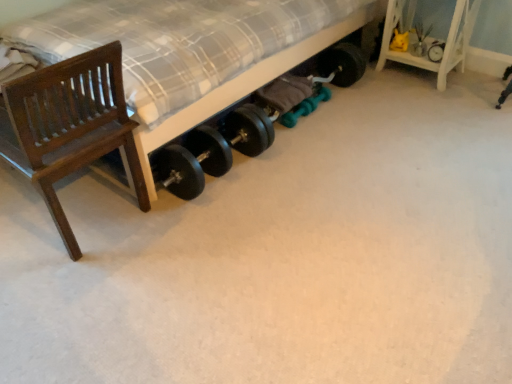
Question: Is there a large distance between black rubber tire at upper right and matte black dumbbells at lower center?

Choices:
 (A) yes
 (B) no

Answer: (A)

Question: Can we say black rubber tire at upper right lies outside matte black dumbbells at lower center?

Choices:
 (A) yes
 (B) no

Answer: (A)

Question: Does black rubber tire at upper right have a greater width compared to matte black dumbbells at lower center?

Choices:
 (A) yes
 (B) no

Answer: (B)

Question: From a real-world perspective, is black rubber tire at upper right on matte black dumbbells at lower center?

Choices:
 (A) yes
 (B) no

Answer: (B)

Question: Does black rubber tire at upper right have a lesser height compared to matte black dumbbells at lower center?

Choices:
 (A) no
 (B) yes

Answer: (B)

Question: From a real-world perspective, is black rubber tire at upper right below matte black dumbbells at lower center?

Choices:
 (A) yes
 (B) no

Answer: (A)

Question: Considering the relative positions of dark wood chair at left and black rubber tire at upper right in the image provided, is dark wood chair at left behind black rubber tire at upper right?

Choices:
 (A) yes
 (B) no

Answer: (B)

Question: Is dark wood chair at left bigger than black rubber tire at upper right?

Choices:
 (A) yes
 (B) no

Answer: (A)

Question: Is dark wood chair at left closer to the viewer compared to black rubber tire at upper right?

Choices:
 (A) yes
 (B) no

Answer: (A)

Question: From a real-world perspective, is dark wood chair at left on top of black rubber tire at upper right?

Choices:
 (A) yes
 (B) no

Answer: (A)

Question: Would you say black rubber tire at upper right is part of dark wood chair at left's contents?

Choices:
 (A) no
 (B) yes

Answer: (A)

Question: Is there a large distance between dark wood chair at left and black rubber tire at upper right?

Choices:
 (A) no
 (B) yes

Answer: (B)

Question: Is dark wood chair at left located outside matte black dumbbells at lower center?

Choices:
 (A) yes
 (B) no

Answer: (A)